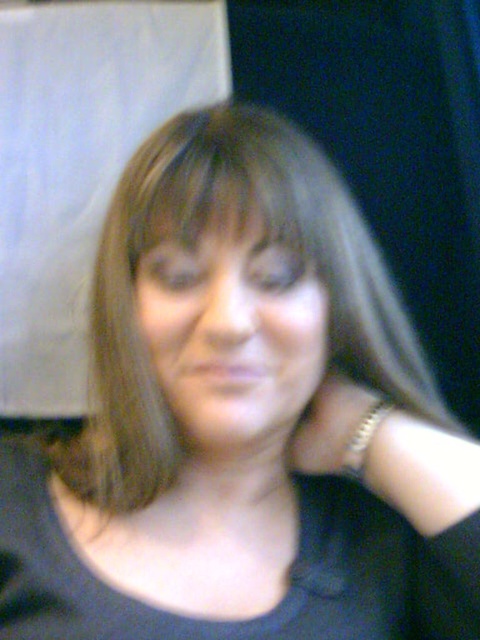
Based on the scene description, can you determine which object is larger between the smooth skin face at center and the gold metallic bracelet at neck?

The smooth skin face at center is larger than the gold metallic bracelet at neck according to the description.

Based on the scene description, which object is wider between the smooth skin face at center and the gold metallic bracelet at neck?

The smooth skin face at center is wider than the gold metallic bracelet at neck according to the description.

Based on the scene description, can you determine the position of the smooth skin face at center relative to the gold metallic bracelet at right?

The smooth skin face at center is to the left of the gold metallic bracelet at right according to the description.